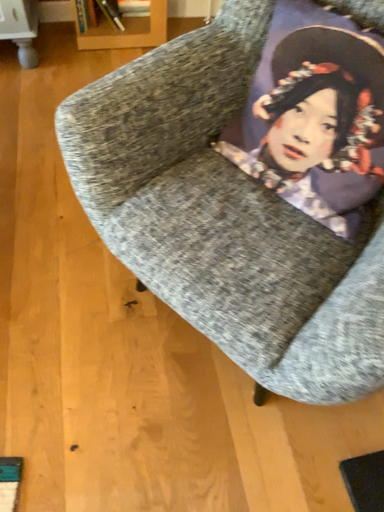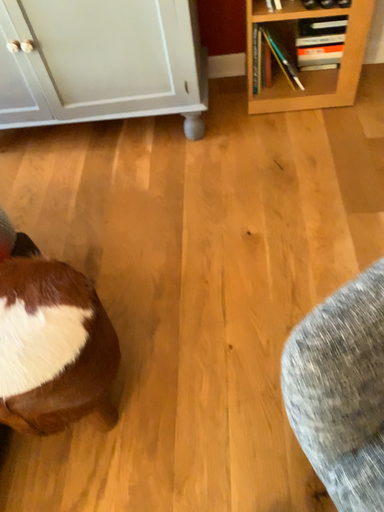
Question: Which way did the camera rotate in the video?

Choices:
 (A) rotated left
 (B) rotated right

Answer: (A)